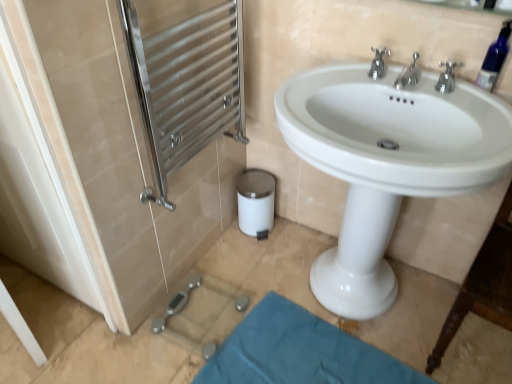
Locate an element on the screen. The width and height of the screenshot is (512, 384). free space above teal fabric bath mat at lower center (from a real-world perspective) is located at coordinates (303, 356).